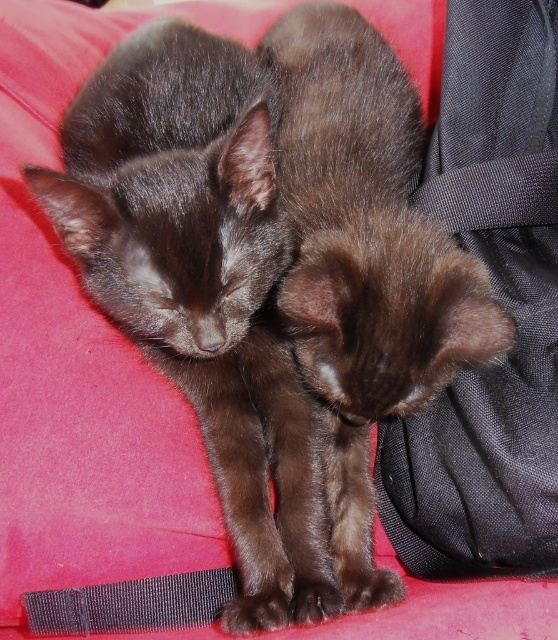
Question: Is the position of shiny brown kitten at center more distant than that of black textured strap at lower left?

Choices:
 (A) yes
 (B) no

Answer: (B)

Question: Is shiny brown kitten at center above black textured strap at lower left?

Choices:
 (A) yes
 (B) no

Answer: (A)

Question: Considering the relative positions of shiny brown kitten at center and black textured strap at lower left in the image provided, where is shiny brown kitten at center located with respect to black textured strap at lower left?

Choices:
 (A) right
 (B) left

Answer: (A)

Question: Which object appears farthest from the camera in this image?

Choices:
 (A) shiny brown kitten at center
 (B) black textured strap at lower left

Answer: (B)